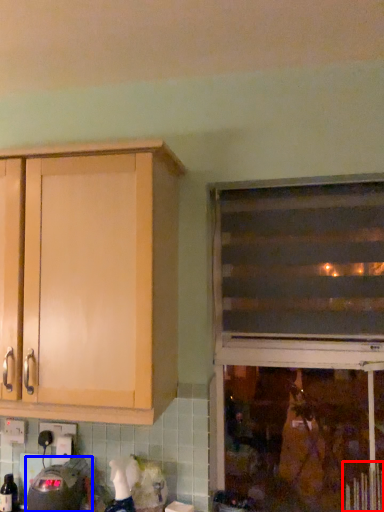
Question: Which of the following is the closest to the observer, radiator (highlighted by a red box) or appliance (highlighted by a blue box)?

Choices:
 (A) radiator
 (B) appliance

Answer: (A)